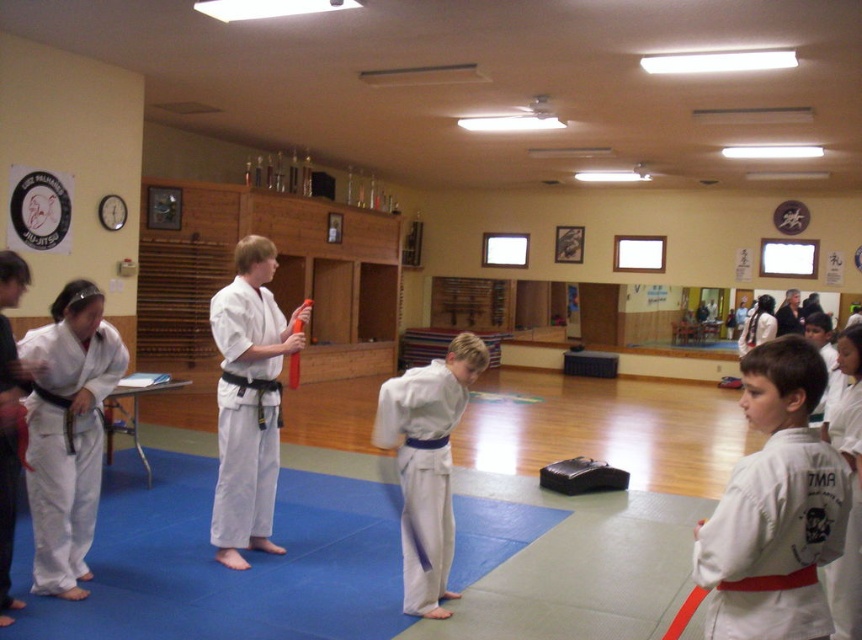
Does white matte kimono at center appear on the right side of white cotton kimono at center?

Yes, white matte kimono at center is to the right of white cotton kimono at center.

Who is lower down, white matte kimono at center or white cotton kimono at center?

Positioned lower is white cotton kimono at center.

Between point (761, 580) and point (405, 609), which one is positioned behind?

The point (405, 609) is behind.

Locate an element on the screen. The width and height of the screenshot is (862, 640). white matte kimono at center is located at coordinates (775, 508).